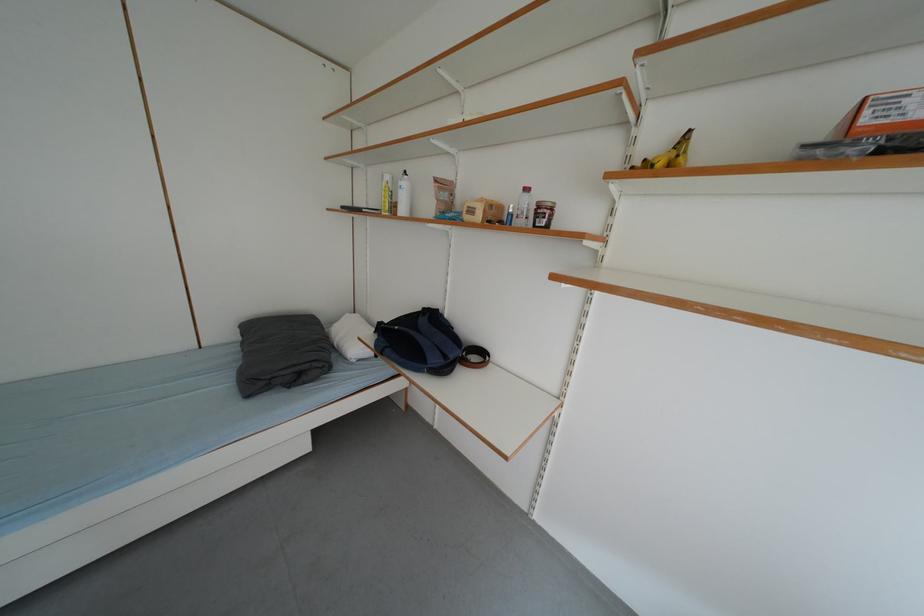
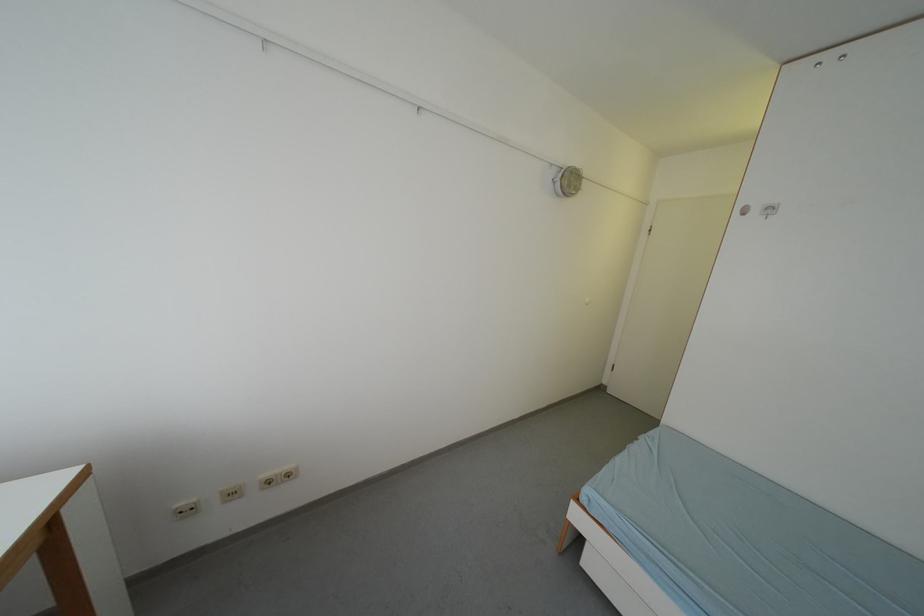
Question: The camera is either moving clockwise (left) or counter-clockwise (right) around the object. The first image is from the beginning of the video and the second image is from the end. Is the camera moving left or right when shooting the video?

Choices:
 (A) Left
 (B) Right

Answer: (B)